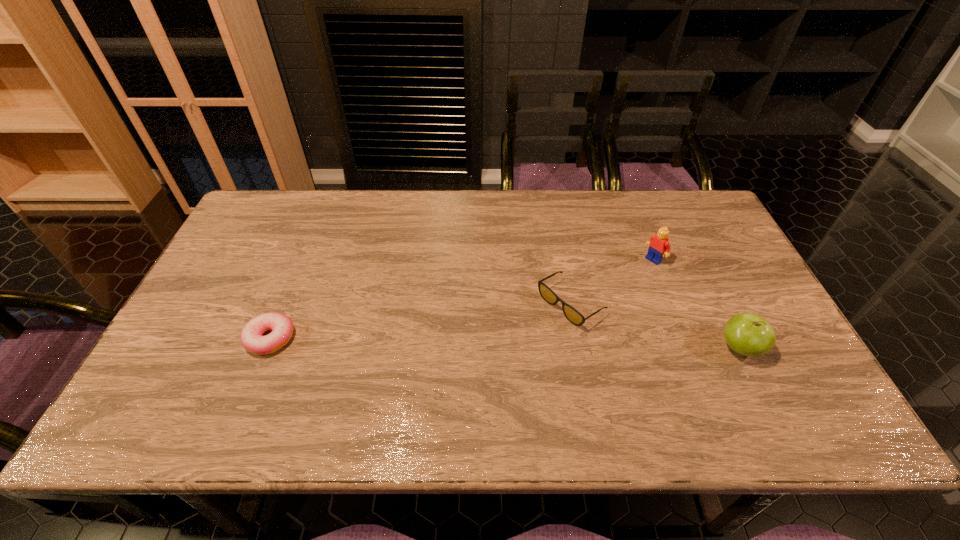
Identify the location of blank region between the apple and the doughnut. This screenshot has height=540, width=960. (505, 343).

Identify the location of free space between the rightmost object and the farthest object. (696, 304).

Where is `free space between the Lego and the second shortest object`? The height and width of the screenshot is (540, 960). free space between the Lego and the second shortest object is located at coordinates (612, 282).

Where is `vacant area that lies between the third object from left to right and the rightmost object`? The image size is (960, 540). vacant area that lies between the third object from left to right and the rightmost object is located at coordinates (696, 304).

Identify which object is located as the second nearest to the leftmost object. Please provide its 2D coordinates. Your answer should be formatted as a tuple, i.e. [(x, y)], where the tuple contains the x and y coordinates of a point satisfying the conditions above.

[(658, 244)]

In order to click on the second closest object to the third object from right to left in this screenshot , I will do 747,334.

Locate an element on the screen. Image resolution: width=960 pixels, height=540 pixels. free spot that satisfies the following two spatial constraints: 1. on the front side of the third object from left to right; 2. on the left side of the apple is located at coordinates (688, 348).

Where is `free space that satisfies the following two spatial constraints: 1. on the front side of the rightmost object; 2. on the right side of the shortest object`? free space that satisfies the following two spatial constraints: 1. on the front side of the rightmost object; 2. on the right side of the shortest object is located at coordinates (266, 348).